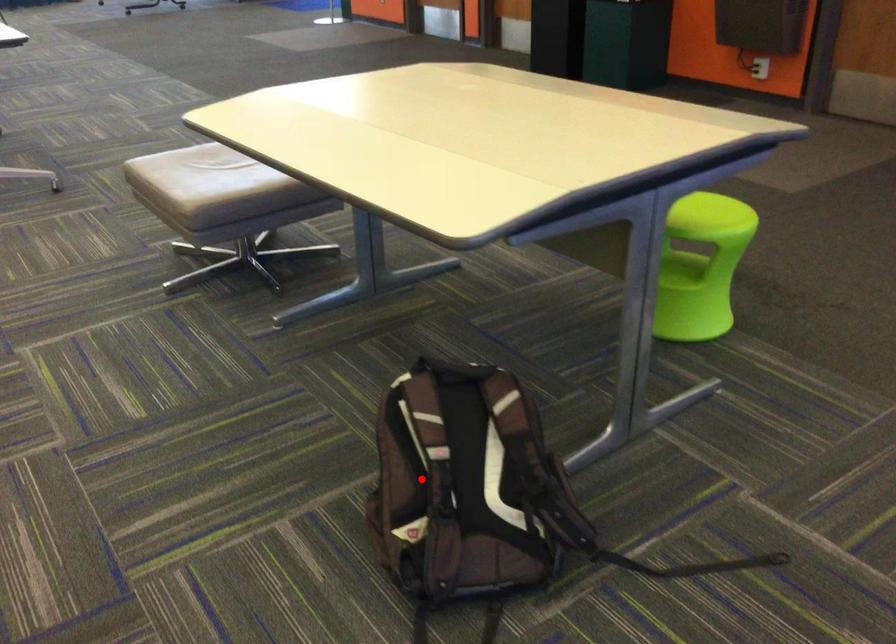
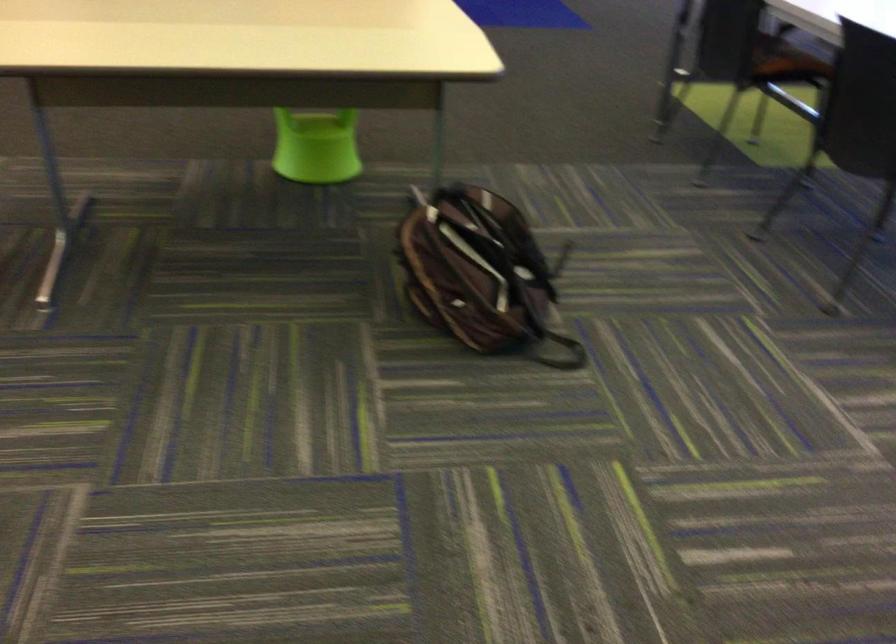
Question: I am providing you with two images of the same scene from different viewpoints. A red point is shown in image1. For the corresponding object point in image2, is it positioned nearer or farther from the camera?

Choices:
 (A) Nearer
 (B) Farther

Answer: (B)